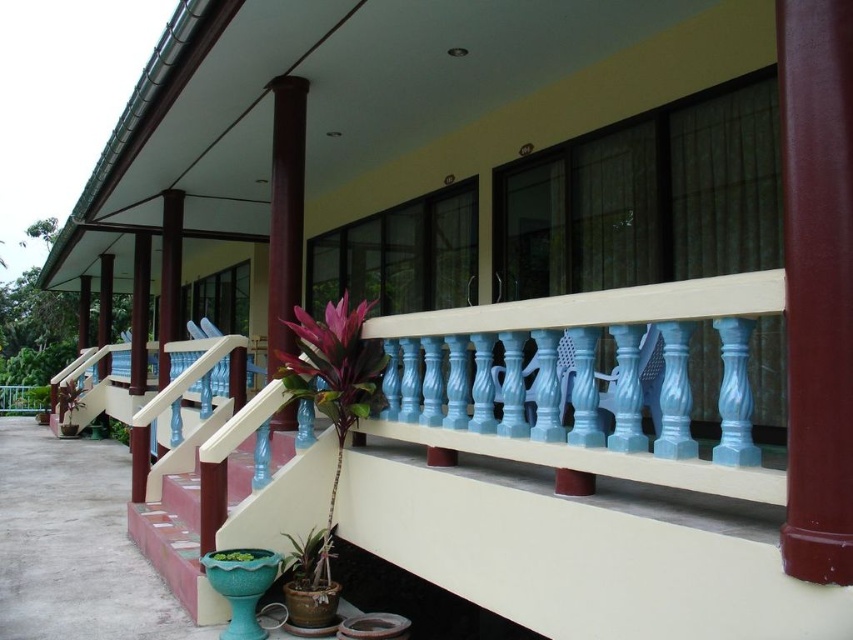
You are standing on the walkway and want to see the green matte plant at lower center clearly. Is it possible to see it without moving around the brown polished wood column at center?

The green matte plant at lower center is behind the brown polished wood column at center, so you cannot see it clearly without moving around the column.

Looking at this image, you are standing on the walkway and want to move from the point at coordinates point (x=270, y=320) to the point at coordinates point (x=213, y=557). Which direction should you move to get closer to the latter point?

To move from point (x=270, y=320) to point (x=213, y=557), you should move towards the right and slightly forward since point (x=213, y=557) is further away from the viewer compared to point (x=270, y=320).

You are standing at the bottom of the steps leading to the walkway. You need to place a 6 feet long decorative banner between the brown polished wood column at center and the green matte planter at lower center. Is there enough space for the banner to fit without bending it?

The brown polished wood column at center is 5.93 feet away from the green matte planter at lower center. Since the banner is 6 feet long, the distance between them is slightly shorter than the banner. Therefore, the banner cannot be placed straight without bending it.